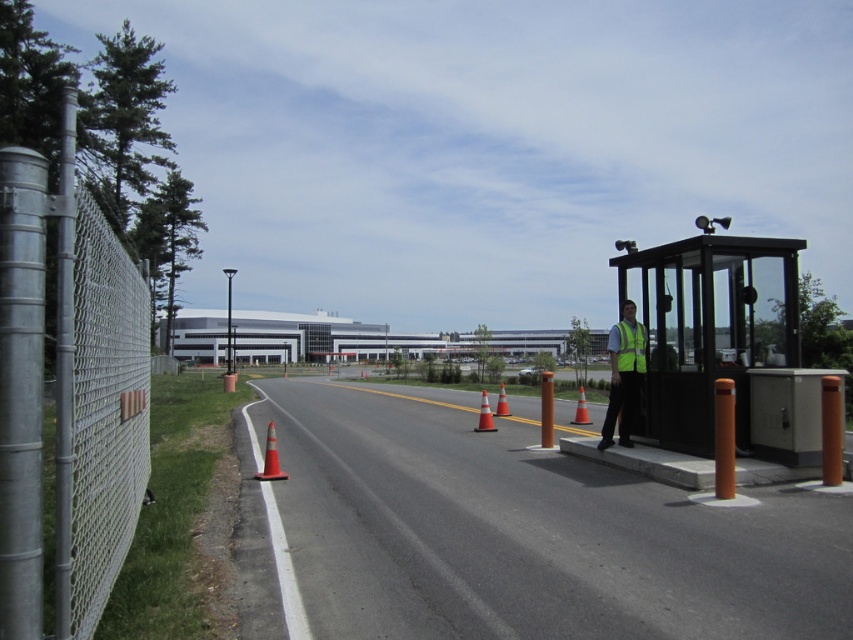
Can you confirm if silver chain-link fence at left is thinner than orange matte traffic cone at center?

In fact, silver chain-link fence at left might be wider than orange matte traffic cone at center.

Is silver chain-link fence at left wider than orange matte traffic cone at center?

Yes.

Locate an element on the screen. The height and width of the screenshot is (640, 853). silver chain-link fence at left is located at coordinates (100, 420).

Which is more to the left, transparent glass booth at right or high visibility yellow vest at right?

transparent glass booth at right

Is transparent glass booth at right shorter than high visibility yellow vest at right?

Incorrect, transparent glass booth at right's height does not fall short of high visibility yellow vest at right's.

Measure the distance between point (x=666, y=326) and camera.

9.91 meters

What are the coordinates of `transparent glass booth at right` in the screenshot? It's located at (721, 342).

Between transparent glass booth at right and high visibility fabric safety vest at right, which one is positioned higher?

transparent glass booth at right is above.

Does transparent glass booth at right have a lesser height compared to high visibility fabric safety vest at right?

No, transparent glass booth at right is not shorter than high visibility fabric safety vest at right.

Locate an element on the screen. transparent glass booth at right is located at coordinates (721, 342).

Locate an element on the screen. Image resolution: width=853 pixels, height=640 pixels. transparent glass booth at right is located at coordinates (721, 342).